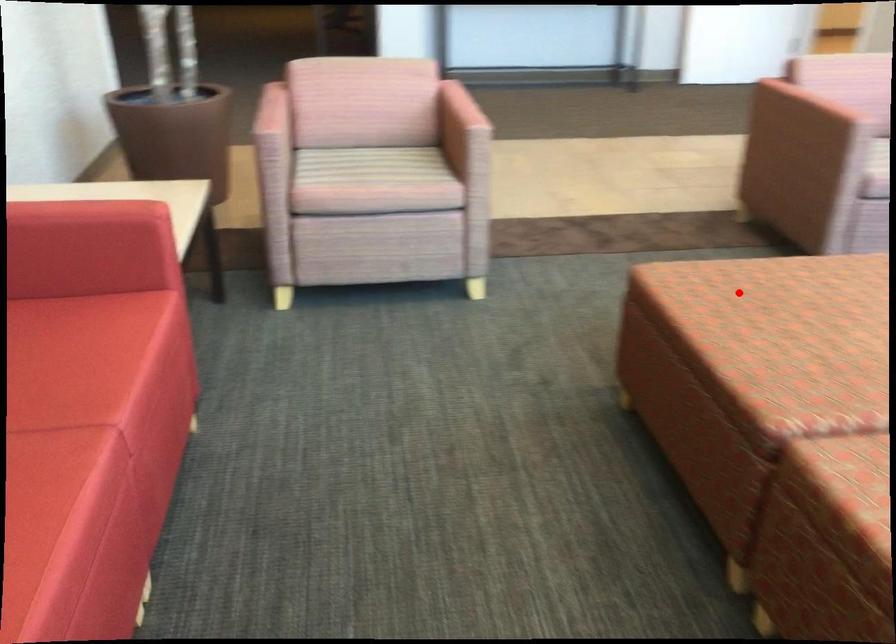
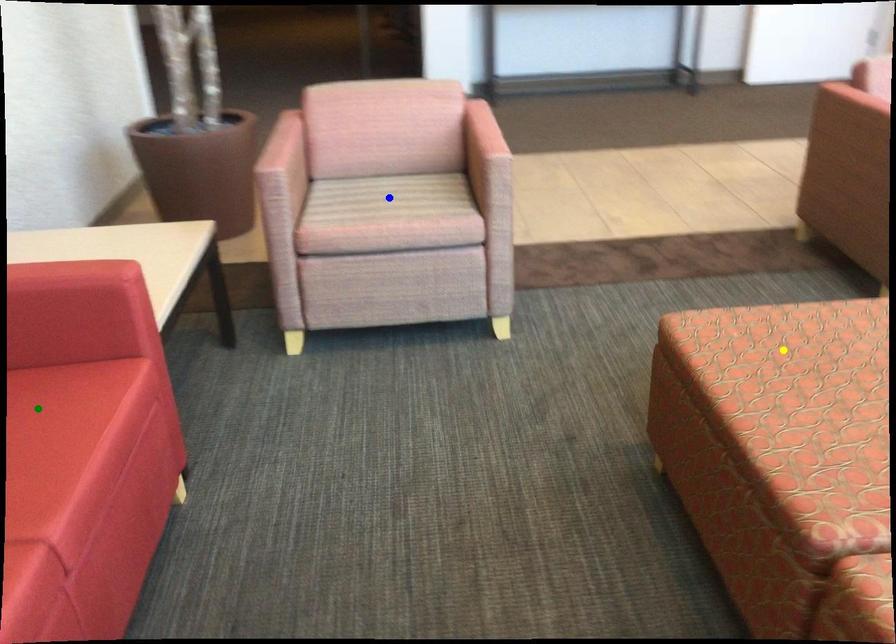
Question: I am providing you with two images of the same scene from different viewpoints. A red point is marked on the first image. You are given multiple points on the second image. Which spot in image 2 lines up with the point in image 1?

Choices:
 (A) green point
 (B) yellow point
 (C) blue point

Answer: (B)